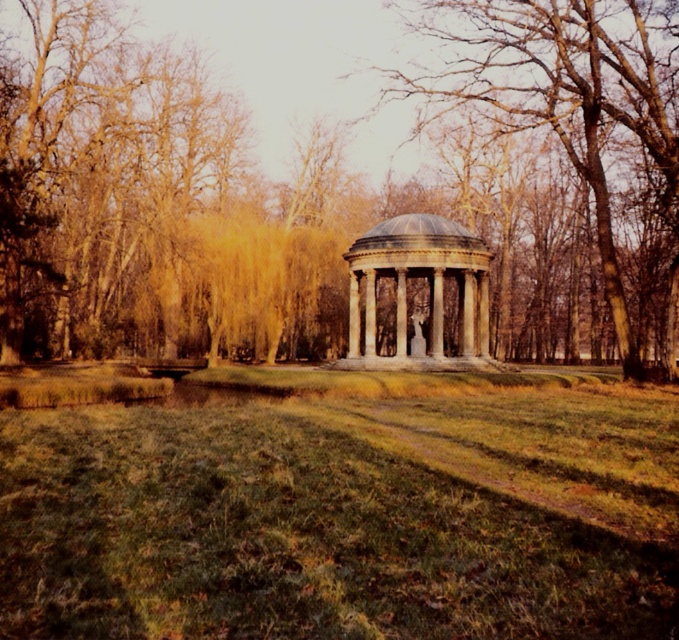
You are standing in the park and want to take a photo of the smooth gray stone gazebo at center and the white marble gazebo at center. Which gazebo should you focus on first to ensure both are in the frame?

You should focus on the smooth gray stone gazebo at center first because it is closer to you than the white marble gazebo at center, so it will be in the foreground of the photo.

You are standing in the park and see both the smooth gray stone gazebo at center and the white marble gazebo at center. Which one is positioned higher in the image?

The smooth gray stone gazebo at center is positioned higher than the white marble gazebo at center in the image.